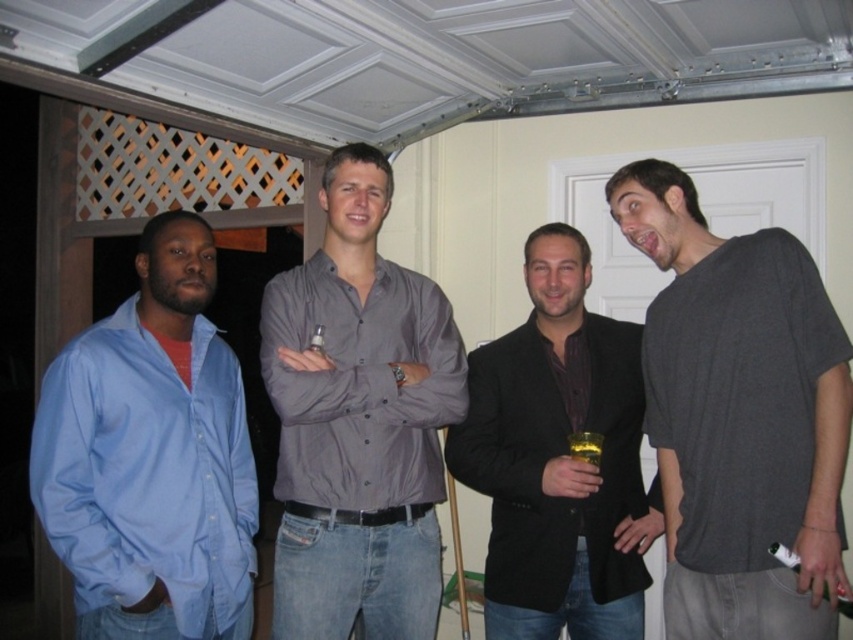
You are standing in the room and want to touch the two points marked in the image. Which point, point (175, 609) or point (315, 332), is closer to you?

Point (175, 609) is closer to you than point (315, 332).

You are standing in the room and want to find the matte gray shirt at center. According to the coordinates provided, where should you look relative to the white door in the background?

The matte gray shirt at center is located at coordinates point 0.659 on the x axis and 0.421 on the y axis. Since the white door is part of the background, the matte gray shirt at center is positioned to the right and slightly below the center of the image.

You are a photographer setting up for a group photo. You notice two people in the front row wearing the matte gray shirt at center and the black matte blazer at center. If you want to ensure both are visible in the photo, which one should you position slightly behind the other?

You should position the black matte blazer at center slightly behind the matte gray shirt at center because the matte gray shirt at center is much taller than the black matte blazer at center, so the taller person can be in front without blocking the shorter one.